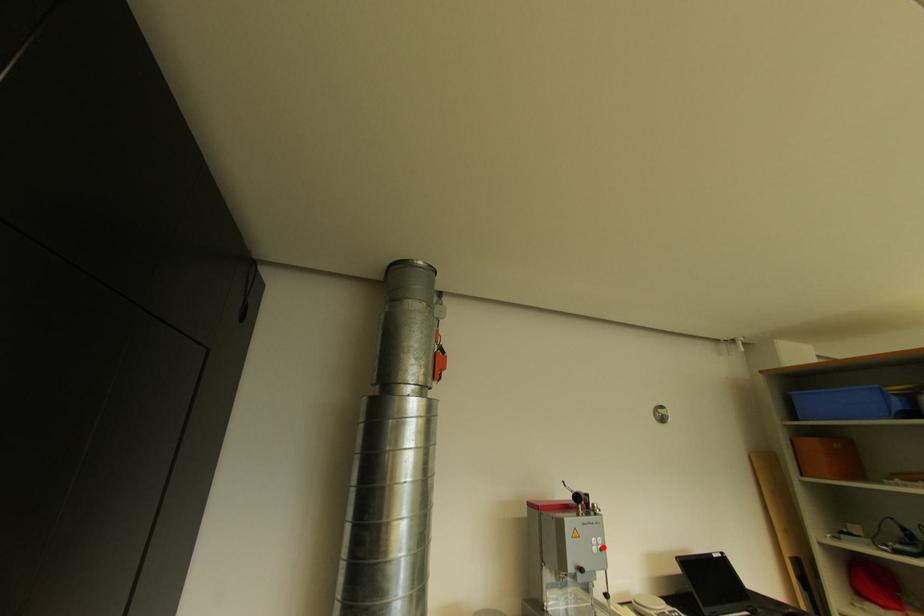
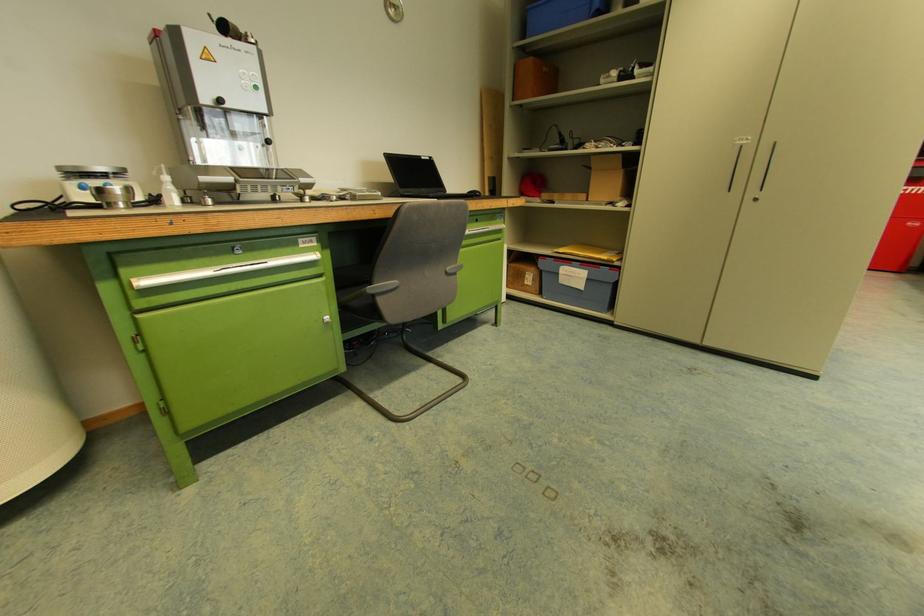
Locate, in the second image, the point that corresponds to the highlighted location in the first image.

(257, 84)